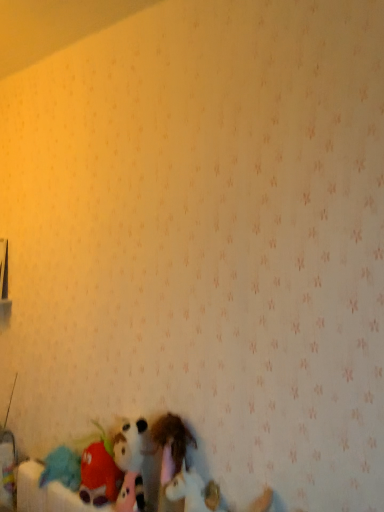
Question: Does fluffy plush toy at lower left, the 3th toy from the right, have a greater height compared to white plush unicorn at lower center, the third toy from the left?

Choices:
 (A) yes
 (B) no

Answer: (A)

Question: Are fluffy plush toy at lower left, the 3th toy from the right, and white plush unicorn at lower center, the third toy from the left, beside each other?

Choices:
 (A) no
 (B) yes

Answer: (A)

Question: From a real-world perspective, is fluffy plush toy at lower left, the 3th toy from the right, located higher than white plush unicorn at lower center, which is counted as the first toy, starting from the right?

Choices:
 (A) yes
 (B) no

Answer: (A)

Question: Is fluffy plush toy at lower left, which ranks as the first toy in left-to-right order, bigger than white plush unicorn at lower center, the third toy from the left?

Choices:
 (A) yes
 (B) no

Answer: (A)

Question: Considering the relative sizes of fluffy plush toy at lower left, which ranks as the first toy in left-to-right order, and white plush unicorn at lower center, which is counted as the first toy, starting from the right, in the image provided, is fluffy plush toy at lower left, which ranks as the first toy in left-to-right order, shorter than white plush unicorn at lower center, which is counted as the first toy, starting from the right,?

Choices:
 (A) no
 (B) yes

Answer: (A)

Question: Is fluffy plush toy at lower left, the 3th toy from the right, spatially inside white plush unicorn at lower center, which is counted as the first toy, starting from the right, or outside of it?

Choices:
 (A) inside
 (B) outside

Answer: (B)

Question: Is point (122, 477) closer or farther from the camera than point (195, 478)?

Choices:
 (A) closer
 (B) farther

Answer: (B)

Question: Considering the positions of fluffy plush toy at lower left, which ranks as the first toy in left-to-right order, and white plush unicorn at lower center, which is counted as the first toy, starting from the right, in the image, is fluffy plush toy at lower left, which ranks as the first toy in left-to-right order, taller or shorter than white plush unicorn at lower center, which is counted as the first toy, starting from the right,?

Choices:
 (A) tall
 (B) short

Answer: (A)

Question: Looking at their shapes, would you say fluffy plush toy at lower left, the 3th toy from the right, is wider or thinner than white plush unicorn at lower center, which is counted as the first toy, starting from the right?

Choices:
 (A) wide
 (B) thin

Answer: (A)

Question: Relative to fluffy plush toy at lower left, the 3th toy from the right, is fuzzy fabric stuffed animal at lower center, the second toy viewed from the left, in front or behind?

Choices:
 (A) front
 (B) behind

Answer: (A)

Question: Is fuzzy fabric stuffed animal at lower center, the second toy viewed from the left, to the left or to the right of fluffy plush toy at lower left, which ranks as the first toy in left-to-right order, in the image?

Choices:
 (A) left
 (B) right

Answer: (B)

Question: Considering the positions of fuzzy fabric stuffed animal at lower center, positioned as the 2th toy in right-to-left order, and fluffy plush toy at lower left, the 3th toy from the right, in the image, is fuzzy fabric stuffed animal at lower center, positioned as the 2th toy in right-to-left order, bigger or smaller than fluffy plush toy at lower left, the 3th toy from the right,?

Choices:
 (A) big
 (B) small

Answer: (B)

Question: In terms of height, does fuzzy fabric stuffed animal at lower center, positioned as the 2th toy in right-to-left order, look taller or shorter compared to fluffy plush toy at lower left, the 3th toy from the right?

Choices:
 (A) short
 (B) tall

Answer: (B)

Question: In terms of width, does white plush unicorn at lower center, the third toy from the left, look wider or thinner when compared to fluffy plush toy at lower left, which ranks as the first toy in left-to-right order?

Choices:
 (A) thin
 (B) wide

Answer: (A)

Question: Is white plush unicorn at lower center, the third toy from the left, in front of or behind fluffy plush toy at lower left, which ranks as the first toy in left-to-right order, in the image?

Choices:
 (A) behind
 (B) front

Answer: (B)